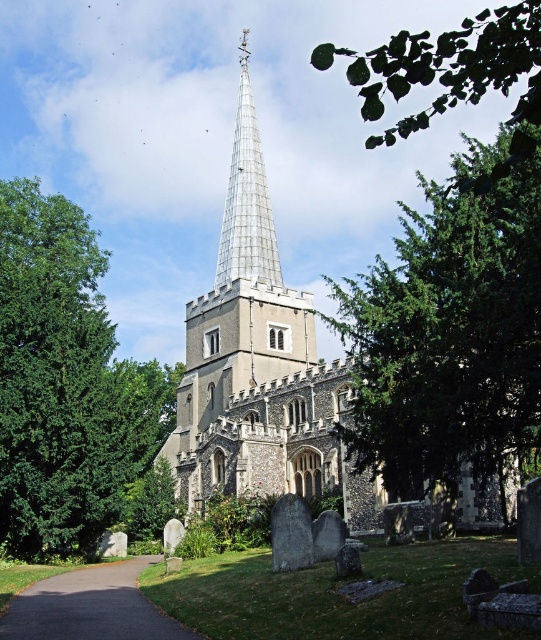
You are a visitor standing at the entrance of the historic church. You notice a green leafy branch at upper right and a brown gravel path at lower left. Which object is taller?

The green leafy branch at upper right is taller than the brown gravel path at lower left.

You are a visitor to the church and notice the green leafy branch at upper right and the green leafy tree at lower center. Which one appears taller in the image?

The green leafy branch at upper right is much taller than the green leafy tree at lower center.